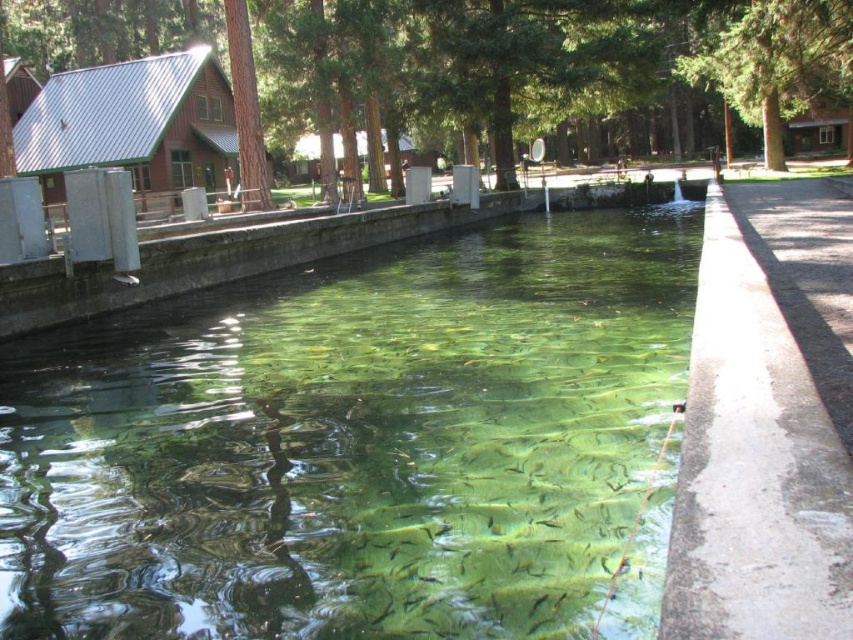
Question: Is the position of green textured tree at upper center less distant than that of green rough bark tree at upper center?

Choices:
 (A) yes
 (B) no

Answer: (A)

Question: Which object is positioned farthest from the metallic red cabin at left?

Choices:
 (A) green textured tree at upper center
 (B) clear glass water at center
 (C) green leafy tree at center

Answer: (A)

Question: Can you confirm if green leafy tree at center is bigger than metallic red cabin at left?

Choices:
 (A) no
 (B) yes

Answer: (B)

Question: Among these objects, which one is nearest to the camera?

Choices:
 (A) clear glass water at center
 (B) green textured tree at upper center
 (C) green rough bark tree at upper center
 (D) green leafy tree at center

Answer: (A)

Question: Which point appears farthest from the camera in this image?

Choices:
 (A) (207, 333)
 (B) (251, 163)
 (C) (790, 90)

Answer: (C)

Question: Can you confirm if clear glass water at center is positioned to the right of green leafy tree at center?

Choices:
 (A) yes
 (B) no

Answer: (B)